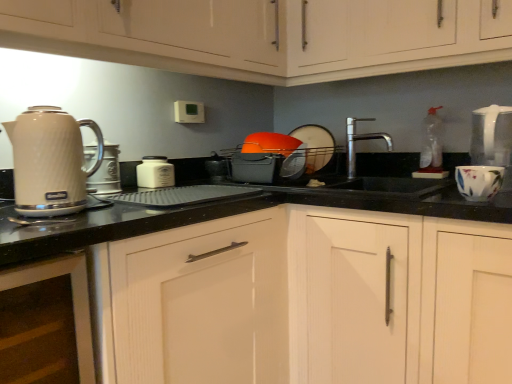
Question: Is white matte jar at center, the 2th kitchen appliance when ordered from front to back, thinner than matte white cabinet at upper center, the third cabinetry from the bottom?

Choices:
 (A) yes
 (B) no

Answer: (A)

Question: Is matte white cabinet at upper center, the second cabinetry viewed from the top, inside white matte jar at center, which is the 2th kitchen appliance in left-to-right order?

Choices:
 (A) no
 (B) yes

Answer: (A)

Question: Is white matte jar at center, the 2th kitchen appliance when ordered from front to back, oriented towards matte white cabinet at upper center, the third cabinetry from the bottom?

Choices:
 (A) no
 (B) yes

Answer: (A)

Question: Is white matte jar at center, the 1th kitchen appliance positioned from the right, further to camera compared to matte white cabinet at upper center, the second cabinetry viewed from the top?

Choices:
 (A) yes
 (B) no

Answer: (A)

Question: Is white matte jar at center, the 2th kitchen appliance when ordered from front to back, closer to the viewer compared to matte white cabinet at upper center, the second cabinetry viewed from the top?

Choices:
 (A) yes
 (B) no

Answer: (B)

Question: Is white matte jar at center, the 1th kitchen appliance positioned from the right, facing away from matte white cabinet at upper center, the second cabinetry viewed from the top?

Choices:
 (A) no
 (B) yes

Answer: (A)

Question: Can you confirm if white wood cabinet at lower left, the second cabinetry in the bottom-to-top sequence, is shorter than matte white cabinet at upper center, the third cabinetry from the bottom?

Choices:
 (A) yes
 (B) no

Answer: (B)

Question: From a real-world perspective, is white wood cabinet at lower left, which is counted as the 3th cabinetry, starting from the top, positioned under matte white cabinet at upper center, the third cabinetry from the bottom, based on gravity?

Choices:
 (A) yes
 (B) no

Answer: (A)

Question: Is white wood cabinet at lower left, which is counted as the 3th cabinetry, starting from the top, smaller than matte white cabinet at upper center, the third cabinetry from the bottom?

Choices:
 (A) no
 (B) yes

Answer: (B)

Question: Is white wood cabinet at lower left, the second cabinetry in the bottom-to-top sequence, at the right side of matte white cabinet at upper center, the third cabinetry from the bottom?

Choices:
 (A) no
 (B) yes

Answer: (A)

Question: Is white wood cabinet at lower left, which is counted as the 3th cabinetry, starting from the top, taller than matte white cabinet at upper center, the third cabinetry from the bottom?

Choices:
 (A) no
 (B) yes

Answer: (B)

Question: From the image's perspective, does white wood cabinet at lower left, the second cabinetry in the bottom-to-top sequence, appear lower than matte white cabinet at upper center, the third cabinetry from the bottom?

Choices:
 (A) yes
 (B) no

Answer: (A)

Question: Is white wood cabinet at center, placed as the 1th cabinetry when sorted from bottom to top, taller than matte white cabinets at upper left, the 4th cabinetry positioned from the bottom?

Choices:
 (A) yes
 (B) no

Answer: (A)